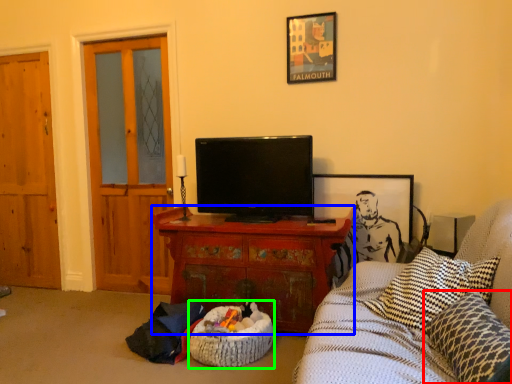
Question: Which object is positioned farthest from pillow (highlighted by a red box)? Select from cabinetry (highlighted by a blue box) and infant bed (highlighted by a green box).

Choices:
 (A) cabinetry
 (B) infant bed

Answer: (A)